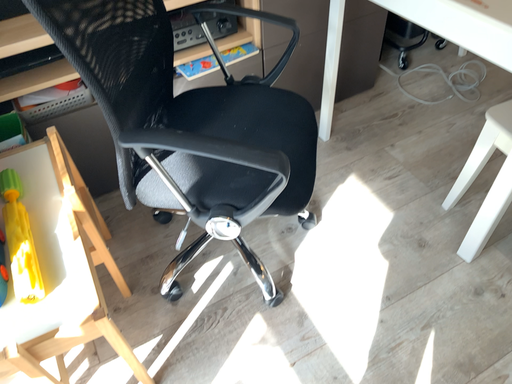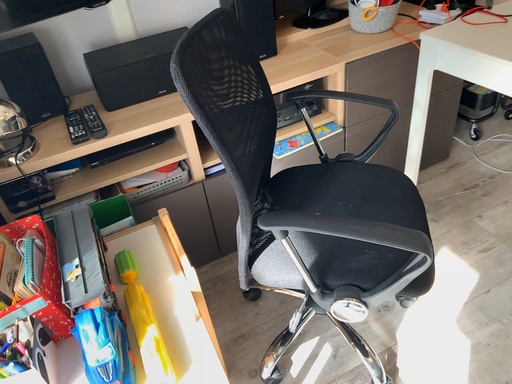
Question: Which way did the camera rotate in the video?

Choices:
 (A) rotated upward
 (B) rotated downward

Answer: (A)